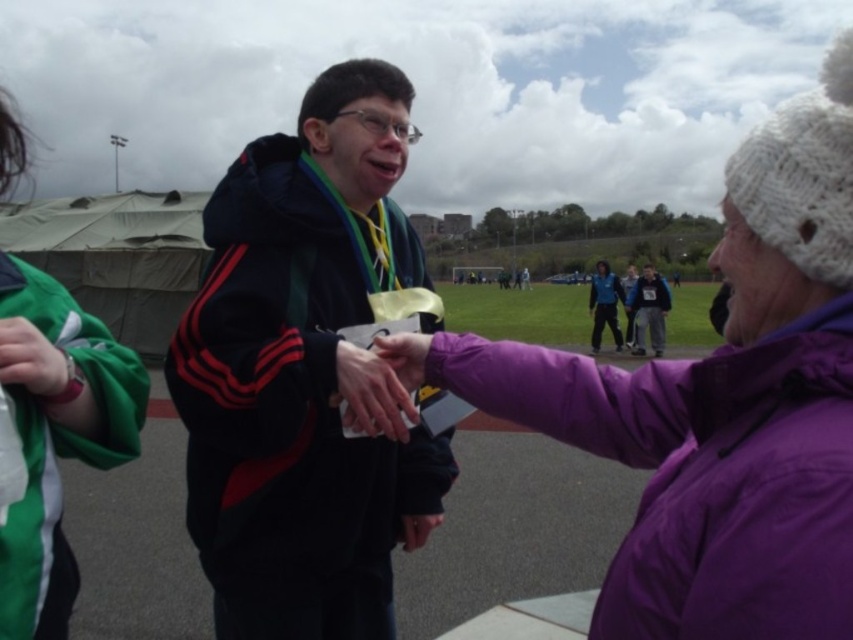
Question: Among these objects, which one is nearest to the camera?

Choices:
 (A) matte blue jacket at center
 (B) matte black jacket at center
 (C) green fabric at left
 (D) dark blue hoodie at center

Answer: (C)

Question: Which point is farther to the camera?

Choices:
 (A) matte blue jacket at center
 (B) green fabric at left

Answer: (A)

Question: Does purple fleece jacket at center lie behind green fabric at left?

Choices:
 (A) no
 (B) yes

Answer: (A)

Question: Based on their relative distances, which object is farther from the green fabric at left?

Choices:
 (A) matte black jacket at center
 (B) matte blue jacket at center

Answer: (B)

Question: In this image, where is purple fleece jacket at center located relative to matte black jacket at center?

Choices:
 (A) below
 (B) above

Answer: (B)

Question: In this image, where is purple fleece jacket at center located relative to green fabric at left?

Choices:
 (A) below
 (B) above

Answer: (A)